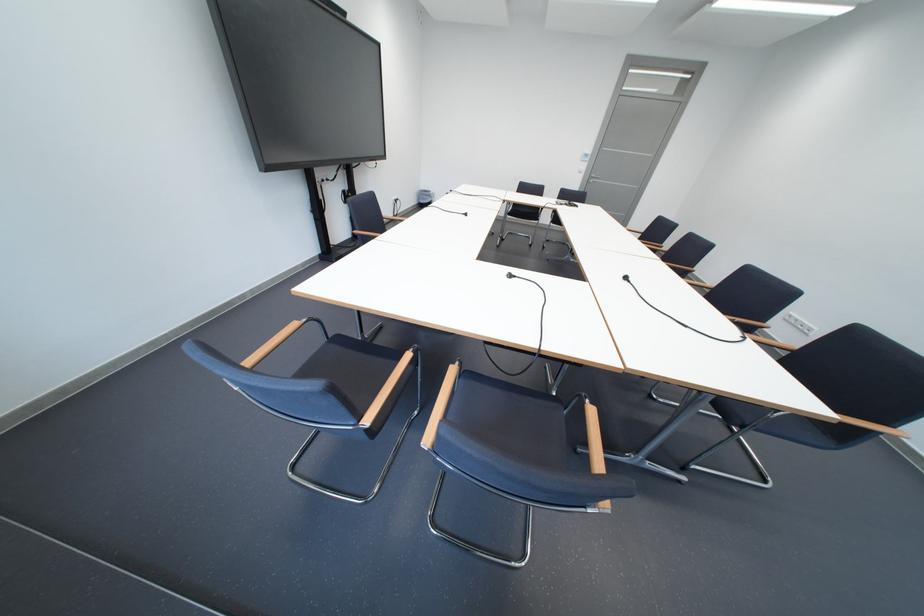
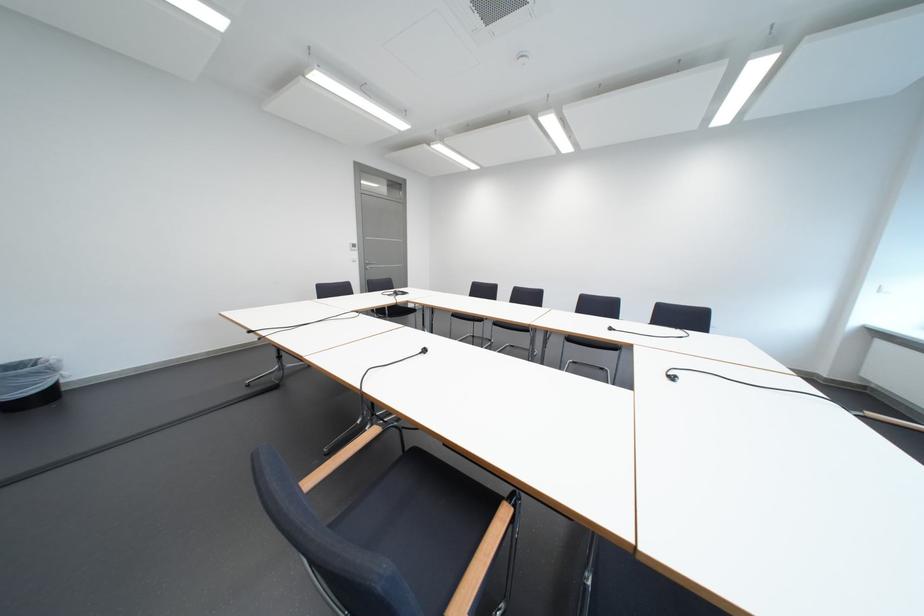
Locate, in the second image, the point that corresponds to (593,177) in the first image.

(369, 265)